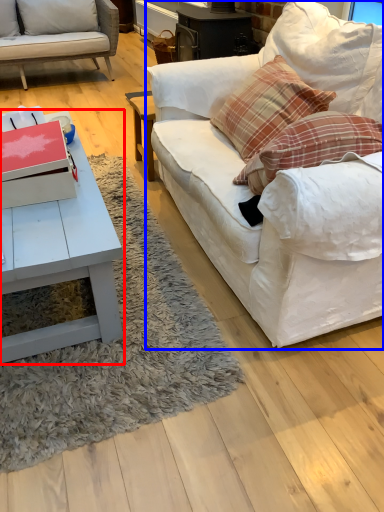
Question: Among these objects, which one is farthest to the camera, coffee table (highlighted by a red box) or studio couch (highlighted by a blue box)?

Choices:
 (A) coffee table
 (B) studio couch

Answer: (A)